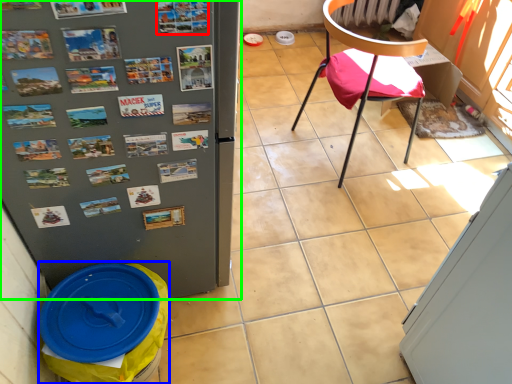
Question: Which object is the farthest from poster (highlighted by a red box)? Choose among these: garbage (highlighted by a blue box) or refrigerator (highlighted by a green box).

Choices:
 (A) garbage
 (B) refrigerator

Answer: (A)